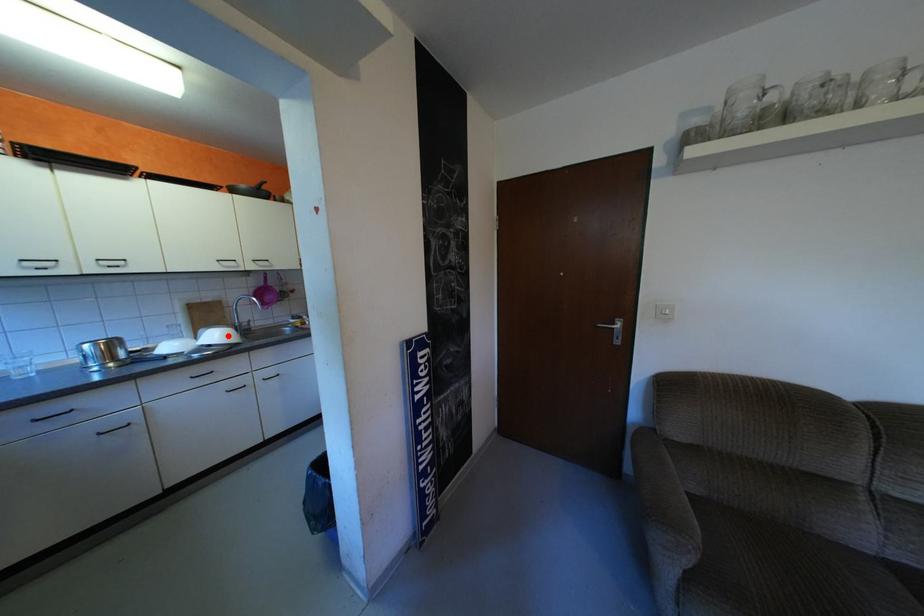
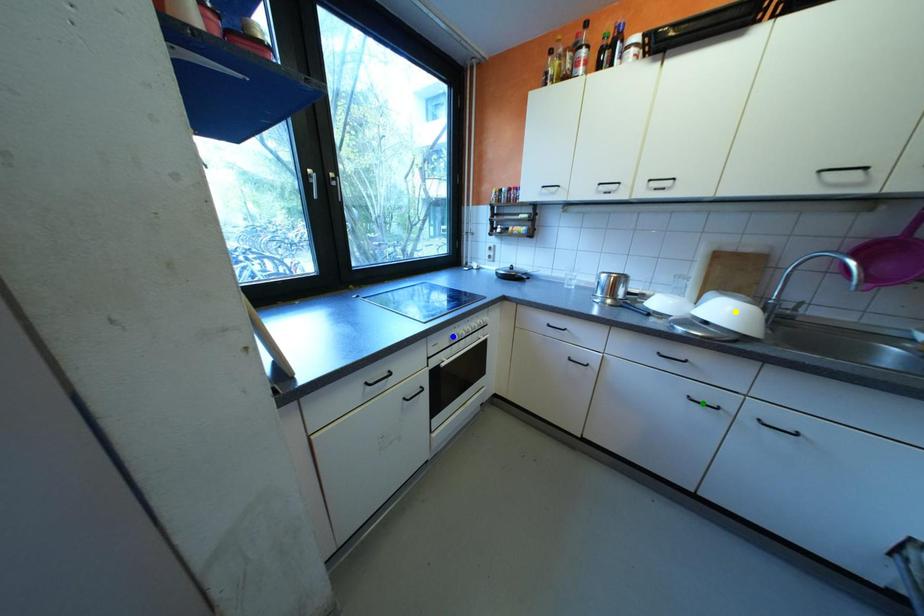
Question: I am providing you with two images of the same scene from different viewpoints. A red point is marked on the first image. You are given multiple points on the second image. Which point in image 2 represents the same 3d spot as the red point in image 1?

Choices:
 (A) yellow point
 (B) blue point
 (C) green point

Answer: (A)